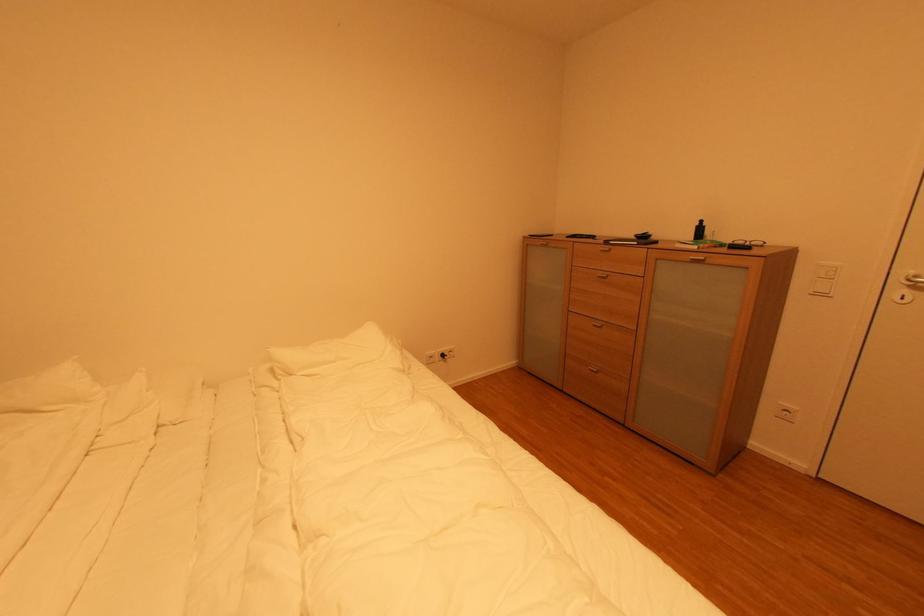
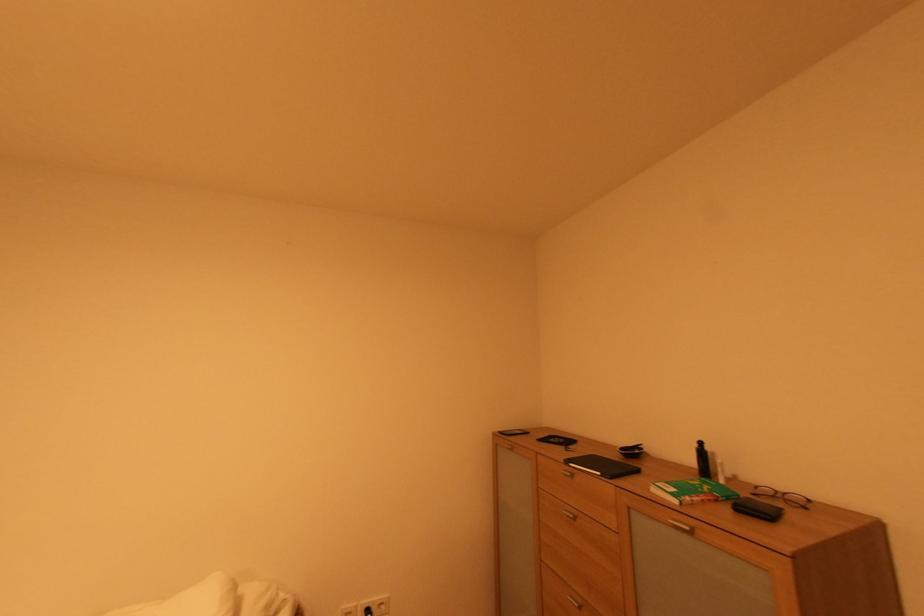
Locate, in the second image, the point that corresponds to [641,245] in the first image.

(604, 475)